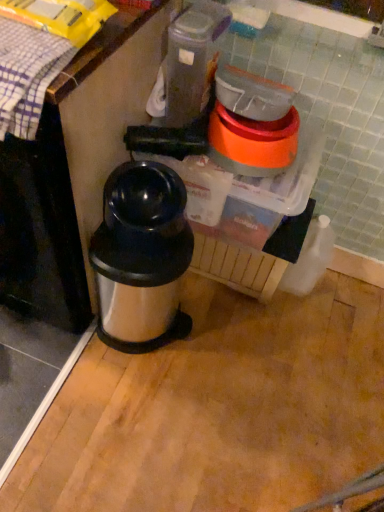
Where is `empty space that is ontop of plaid fabric at upper left`? The image size is (384, 512). empty space that is ontop of plaid fabric at upper left is located at coordinates (23, 49).